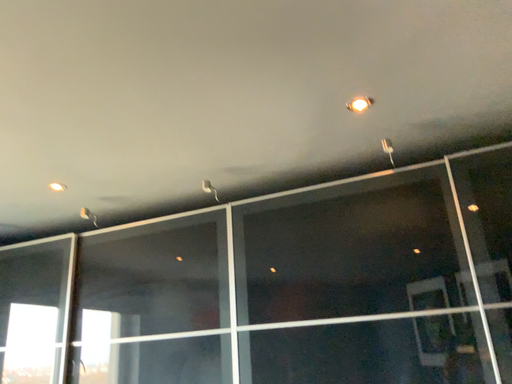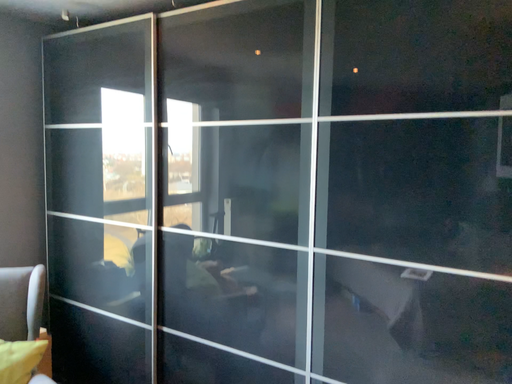
Question: Which way did the camera rotate in the video?

Choices:
 (A) rotated upward
 (B) rotated downward

Answer: (B)